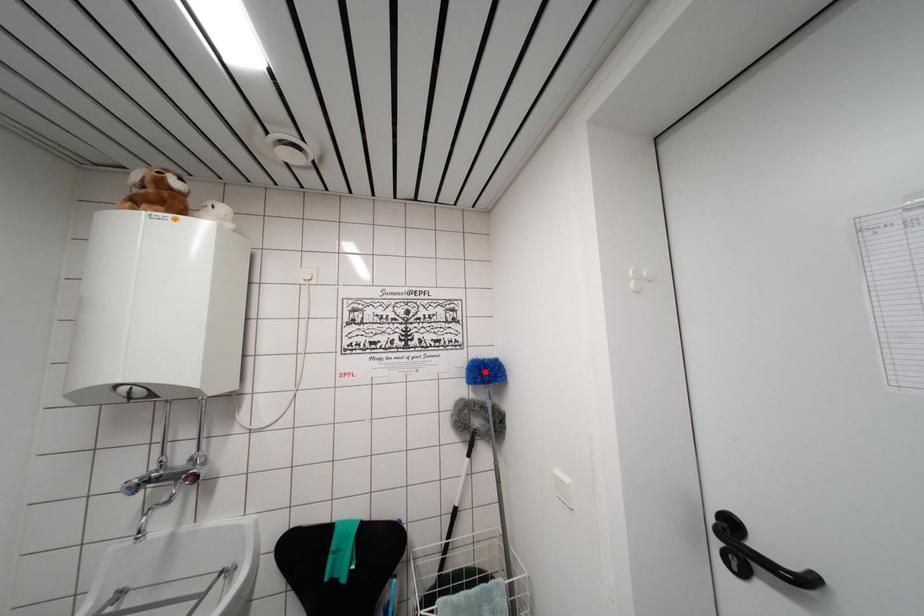
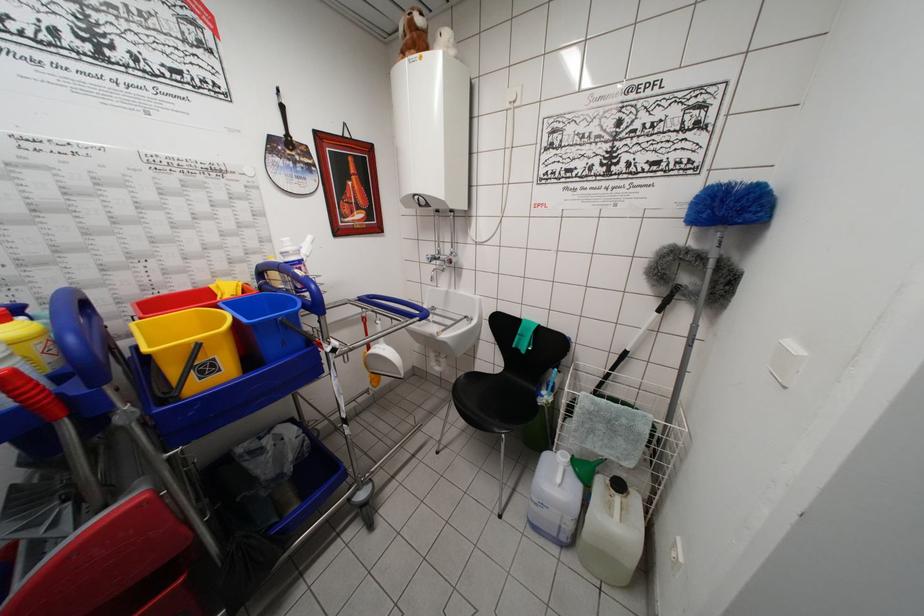
The point at the highlighted location is marked in the first image. Where is the corresponding point in the second image?

(723, 199)